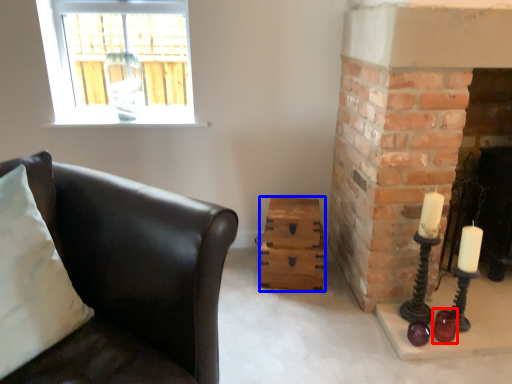
Question: Which of the following is the closest to the observer, candle holder (highlighted by a red box) or drawer (highlighted by a blue box)?

Choices:
 (A) candle holder
 (B) drawer

Answer: (A)